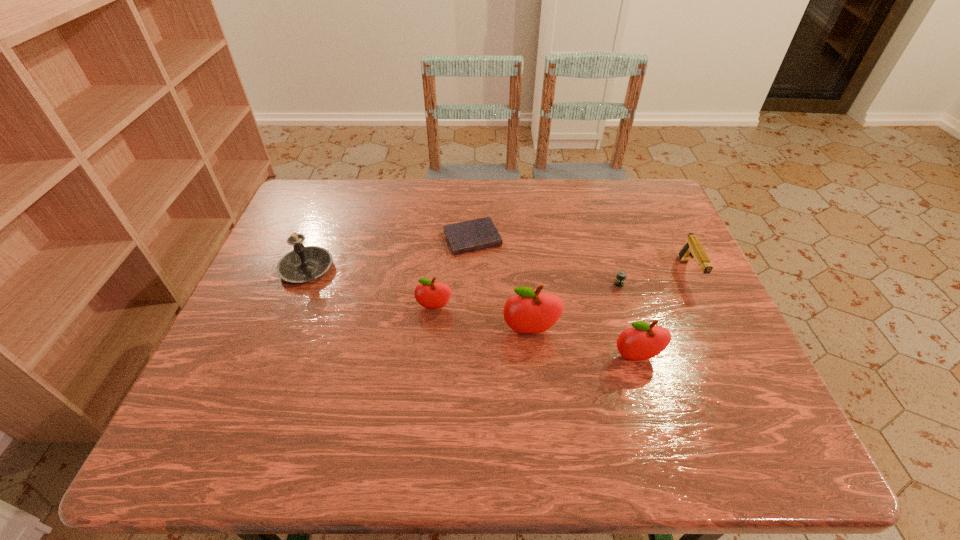
Given the evenly spaced apples in the image, where should an extra apple be added on the right to preserve the spacing? Please point to a vacant space. Please provide its 2D coordinates. Your answer should be formatted as a tuple, i.e. [(x, y)], where the tuple contains the x and y coordinates of a point satisfying the conditions above.

[(755, 387)]